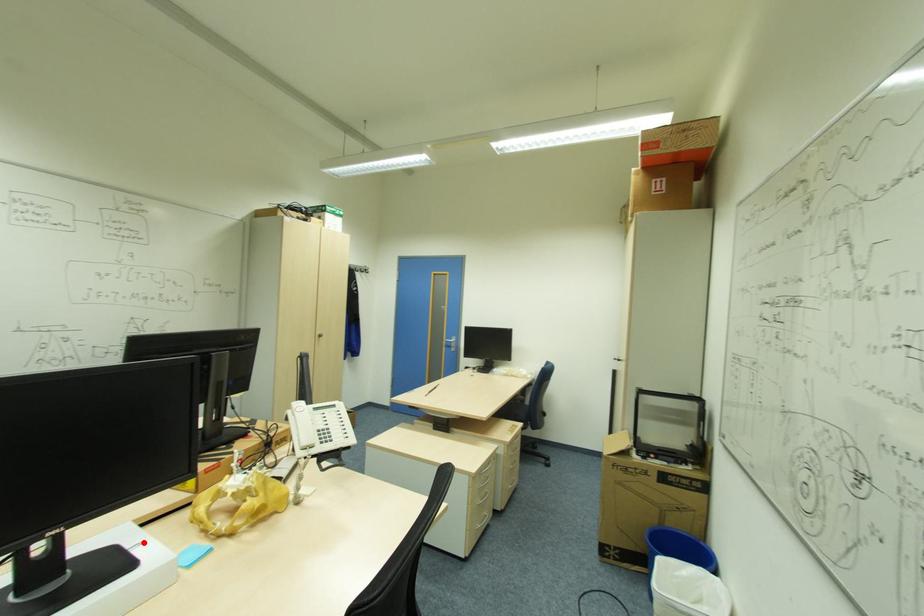
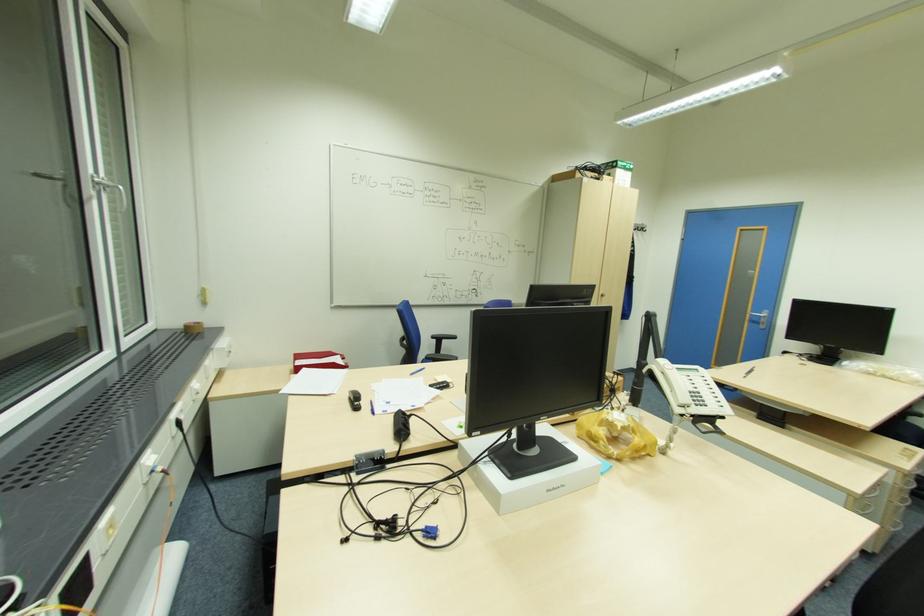
Where in the second image is the point corresponding to the highlighted location from the first image?

(568, 442)